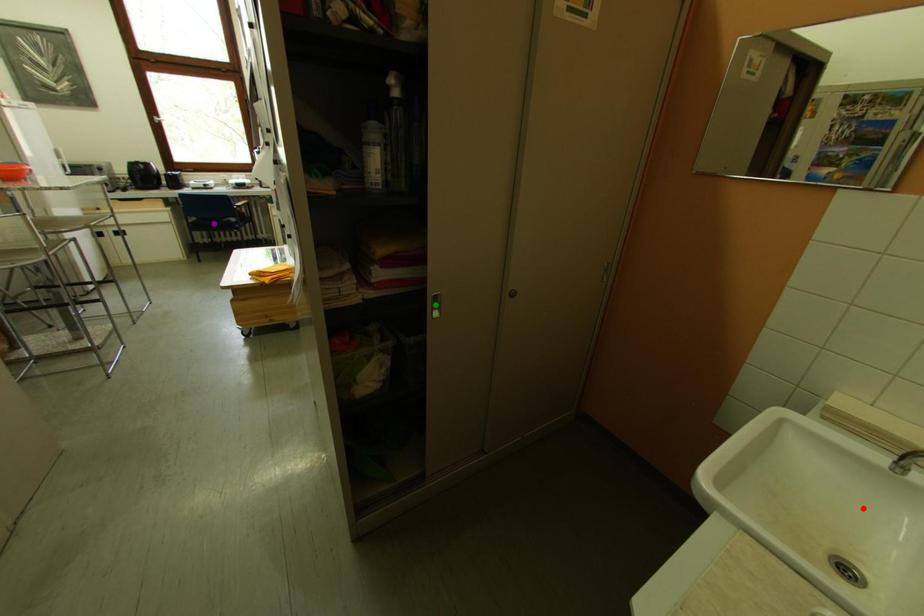
Order these from nearest to farthest:
green point, purple point, red point

red point < green point < purple point